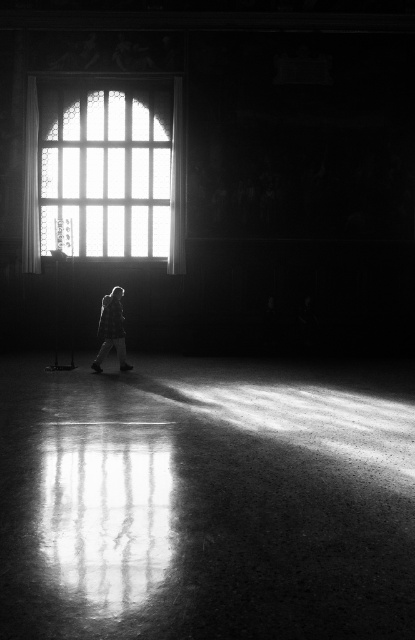
Question: Is clear glass window at upper center thinner than silvery metallic jacket at center?

Choices:
 (A) no
 (B) yes

Answer: (A)

Question: Among these points, which one is farthest from the camera?

Choices:
 (A) (119, 189)
 (B) (90, 368)

Answer: (A)

Question: Does clear glass window at upper center have a smaller size compared to silvery metallic jacket at center?

Choices:
 (A) no
 (B) yes

Answer: (A)

Question: Is clear glass window at upper center positioned in front of silvery metallic jacket at center?

Choices:
 (A) no
 (B) yes

Answer: (A)

Question: Which object is closer to the camera taking this photo?

Choices:
 (A) silvery metallic jacket at center
 (B) clear glass window at upper center

Answer: (A)